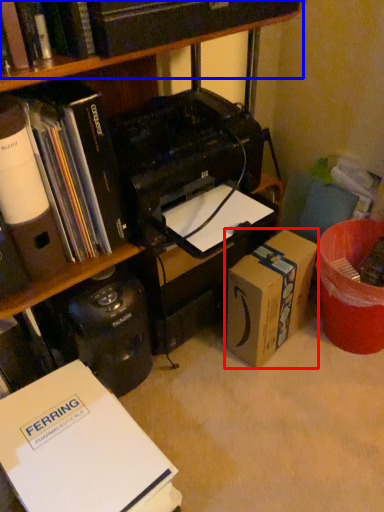
Question: Which object is closer to the camera taking this photo, box (highlighted by a red box) or book (highlighted by a blue box)?

Choices:
 (A) box
 (B) book

Answer: (B)